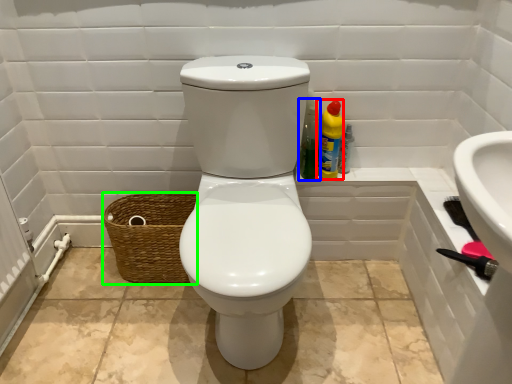
Question: Estimate the real-world distances between objects in this image. Which object is closer to cleaning product (highlighted by a red box), cleaning product (highlighted by a blue box) or basket (highlighted by a green box)?

Choices:
 (A) cleaning product
 (B) basket

Answer: (A)